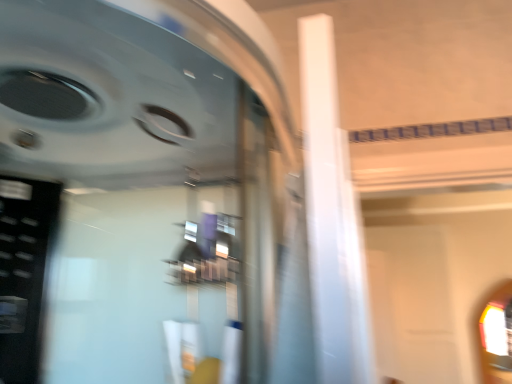
Identify the location of transparent glass at right. Image resolution: width=512 pixels, height=384 pixels. (495, 335).

The width and height of the screenshot is (512, 384). Describe the element at coordinates (495, 335) in the screenshot. I see `transparent glass at right` at that location.

I want to click on transparent glass at right, so click(x=495, y=335).